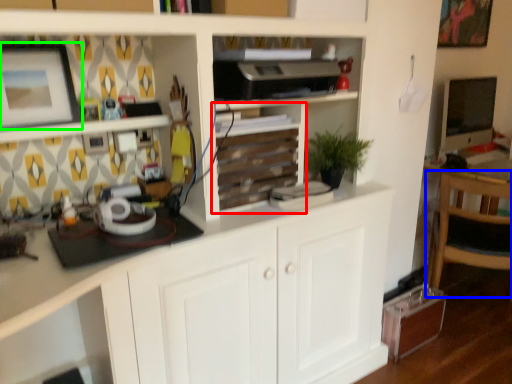
Question: Which is nearer to the shelf (highlighted by a red box)? chair (highlighted by a blue box) or picture frame (highlighted by a green box).

Choices:
 (A) chair
 (B) picture frame

Answer: (B)